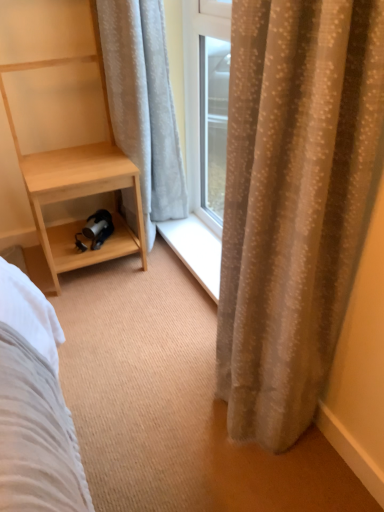
Where is `vacant space that is in between light wood/texture shelf at left and beige textured curtain at right, positioned as the 1th curtain in right-to-left order`? The height and width of the screenshot is (512, 384). vacant space that is in between light wood/texture shelf at left and beige textured curtain at right, positioned as the 1th curtain in right-to-left order is located at coordinates (144, 322).